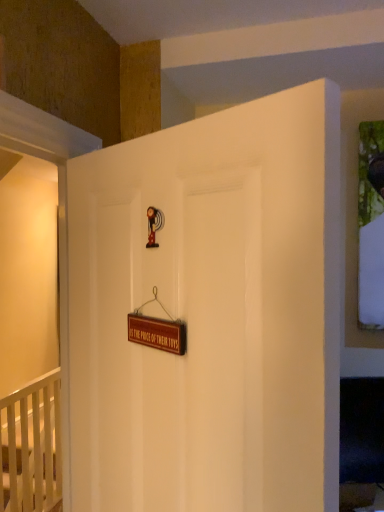
Question: From a real-world perspective, is white matte door at center beneath brown wooden sign at center?

Choices:
 (A) no
 (B) yes

Answer: (B)

Question: Can you confirm if white matte door at center is wider than brown wooden sign at center?

Choices:
 (A) yes
 (B) no

Answer: (A)

Question: Can you confirm if white matte door at center is smaller than brown wooden sign at center?

Choices:
 (A) no
 (B) yes

Answer: (A)

Question: Does white matte door at center lie behind brown wooden sign at center?

Choices:
 (A) no
 (B) yes

Answer: (A)

Question: Is white matte door at center oriented away from brown wooden sign at center?

Choices:
 (A) no
 (B) yes

Answer: (B)

Question: Is point (158, 170) closer or farther from the camera than point (180, 351)?

Choices:
 (A) farther
 (B) closer

Answer: (A)

Question: From the image's perspective, is white matte door at center located above or below brown wooden sign at center?

Choices:
 (A) below
 (B) above

Answer: (A)

Question: Is white matte door at center spatially inside brown wooden sign at center, or outside of it?

Choices:
 (A) outside
 (B) inside

Answer: (A)

Question: In terms of height, does white matte door at center look taller or shorter compared to brown wooden sign at center?

Choices:
 (A) tall
 (B) short

Answer: (A)

Question: From the image's perspective, is white wooden crib at lower left located above or below brown wooden sign at center?

Choices:
 (A) above
 (B) below

Answer: (B)

Question: Considering the positions of white wooden crib at lower left and brown wooden sign at center in the image, is white wooden crib at lower left wider or thinner than brown wooden sign at center?

Choices:
 (A) thin
 (B) wide

Answer: (B)

Question: Is point (33, 485) closer or farther from the camera than point (135, 329)?

Choices:
 (A) farther
 (B) closer

Answer: (A)

Question: In terms of height, does white wooden crib at lower left look taller or shorter compared to brown wooden sign at center?

Choices:
 (A) short
 (B) tall

Answer: (B)

Question: From their relative heights in the image, would you say brown wooden sign at center is taller or shorter than white wooden crib at lower left?

Choices:
 (A) tall
 (B) short

Answer: (B)

Question: Is brown wooden sign at center in front of or behind white wooden crib at lower left in the image?

Choices:
 (A) front
 (B) behind

Answer: (A)